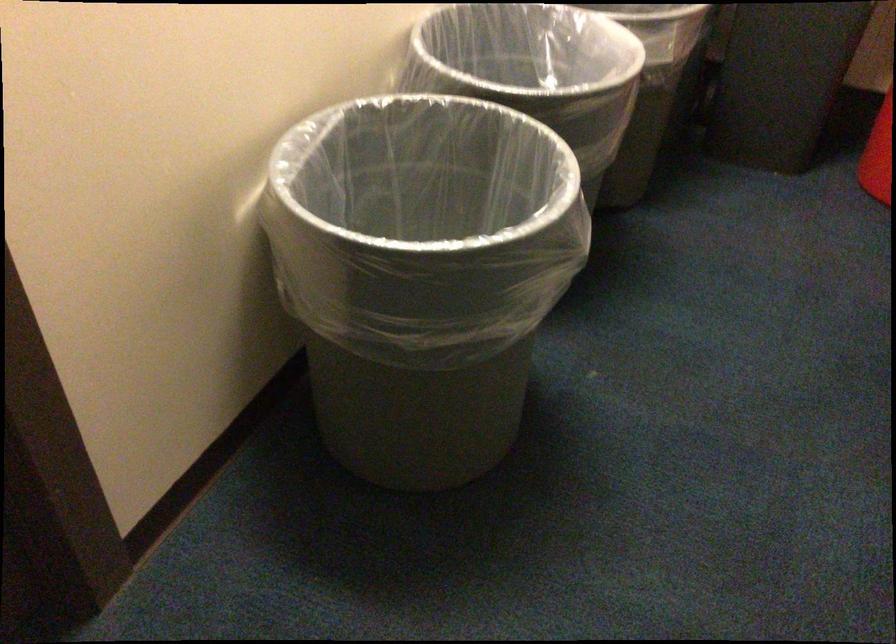
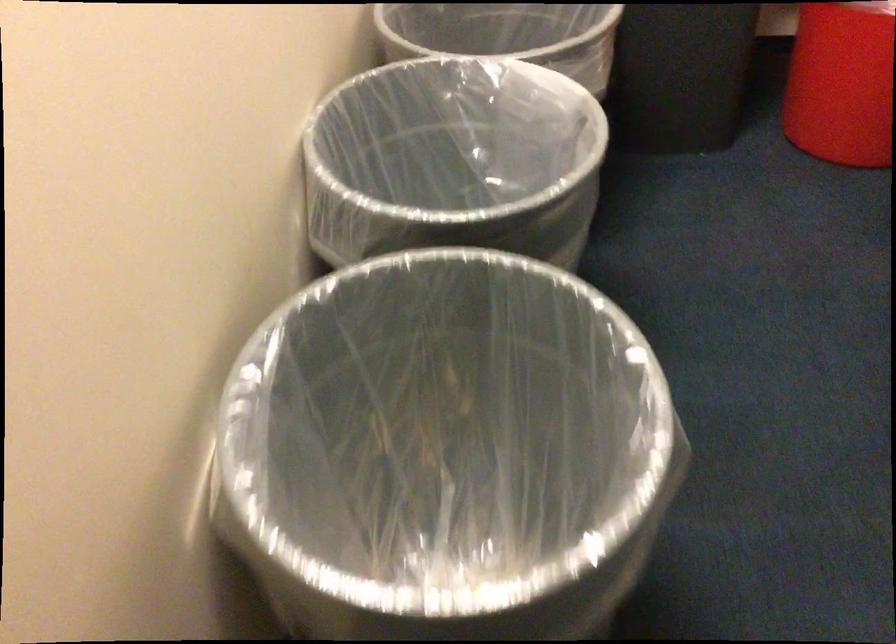
The images are taken continuously from a first-person perspective. In which direction are you moving?

The cameraman moved toward left, forward.